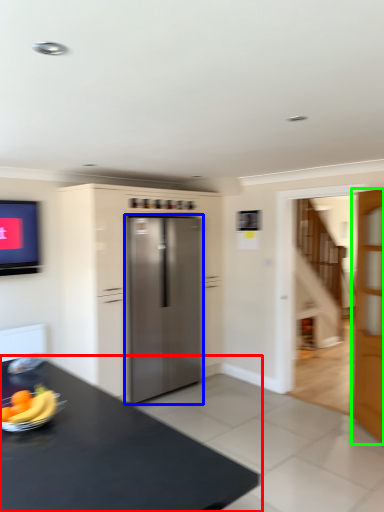
Question: Which object is the farthest from table (highlighted by a red box)? Choose among these: refrigerator (highlighted by a blue box) or door (highlighted by a green box).

Choices:
 (A) refrigerator
 (B) door

Answer: (B)